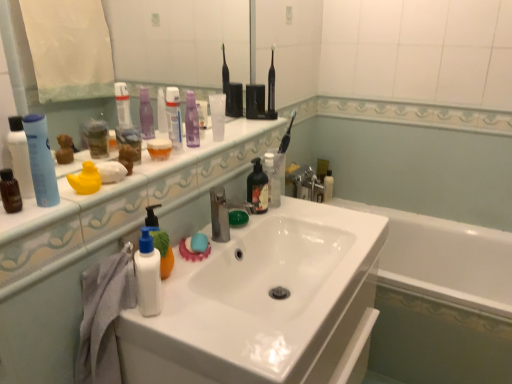
Where is `vacant area located to the right-hand side of translucent plastic bottle at center, which is the fifth mouthwash from front to back`? The image size is (512, 384). vacant area located to the right-hand side of translucent plastic bottle at center, which is the fifth mouthwash from front to back is located at coordinates [302, 212].